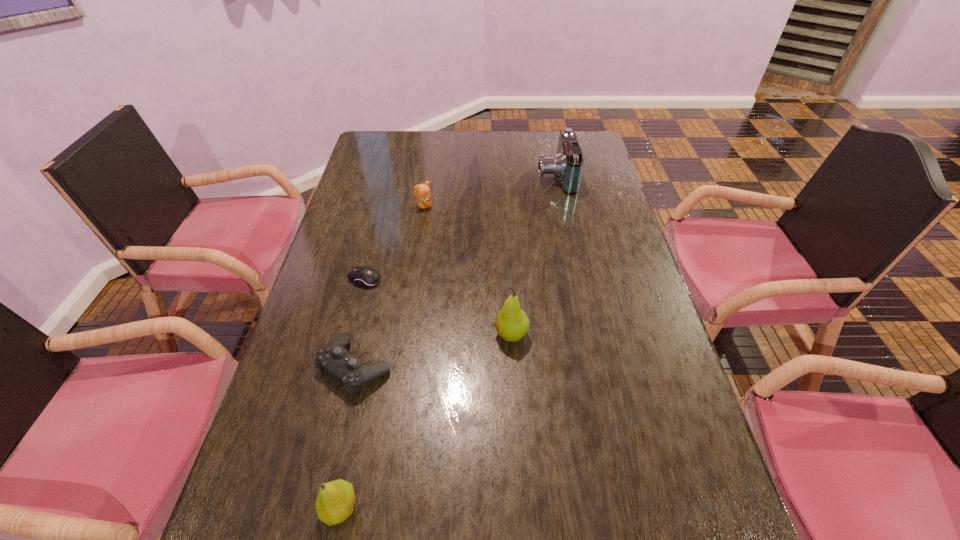
Locate an element on the screen. control is located at coordinates (333, 358).

Where is `free region located 0.310m on the back of the nearest object`? This screenshot has height=540, width=960. free region located 0.310m on the back of the nearest object is located at coordinates (372, 352).

Where is `free spot located 0.140m on the left of the right pear`? This screenshot has height=540, width=960. free spot located 0.140m on the left of the right pear is located at coordinates (438, 334).

Identify the location of vacant region located 0.080m on the front-facing side of the farthest object. The height and width of the screenshot is (540, 960). (514, 176).

The height and width of the screenshot is (540, 960). I want to click on vacant space located 0.070m on the front-facing side of the farthest object, so click(x=516, y=176).

At what (x,y) coordinates should I click in order to perform the action: click on vacant point located on the front-facing side of the farthest object. Please return your answer as a coordinate pair (x, y). Image resolution: width=960 pixels, height=540 pixels. Looking at the image, I should click on (424, 176).

I want to click on vacant area located 0.160m on the face of the teddy bear, so 480,206.

The width and height of the screenshot is (960, 540). I want to click on vacant region located on the front of the shortest object, so click(x=358, y=308).

You are a GUI agent. You are given a task and a screenshot of the screen. Output one action in this format:
    pyautogui.click(x=<x>, y=<y>)
    Task: Click on the free region located 0.300m on the back of the fifth tallest object
    The width and height of the screenshot is (960, 540).
    Given the screenshot: What is the action you would take?
    pyautogui.click(x=380, y=255)

Find the location of `object that is at the far edge`. object that is at the far edge is located at coordinates (567, 165).